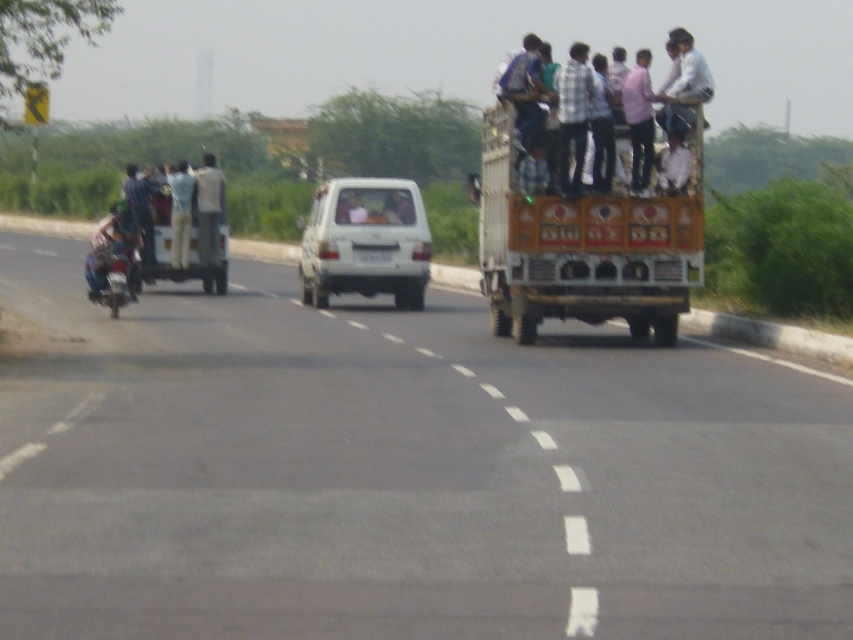
Is metallic silver motorcycle at left to the right of white glossy van at center from the viewer's perspective?

No, metallic silver motorcycle at left is not to the right of white glossy van at center.

Can you confirm if metallic silver motorcycle at left is positioned above white glossy van at center?

No.

Find the location of `metallic silver motorcycle at left`. metallic silver motorcycle at left is located at coordinates (111, 273).

Identify the location of metallic silver motorcycle at left. This screenshot has width=853, height=640. (111, 273).

Is plaid fabric shirt at center bigger than light blue fabric shirt at center?

Yes, plaid fabric shirt at center is bigger than light blue fabric shirt at center.

Consider the image. Measure the distance between point (566,148) and camera.

The distance of point (566,148) from camera is 64.73 feet.

The height and width of the screenshot is (640, 853). Describe the element at coordinates (654, 100) in the screenshot. I see `plaid fabric shirt at center` at that location.

I want to click on plaid fabric shirt at center, so click(654, 100).

Between point (611, 253) and point (173, 188), which one is positioned in front?

Point (611, 253) is in front.

Measure the distance between painted wooden truck at center and camera.

painted wooden truck at center and camera are 21.29 meters apart from each other.

The height and width of the screenshot is (640, 853). I want to click on painted wooden truck at center, so click(583, 246).